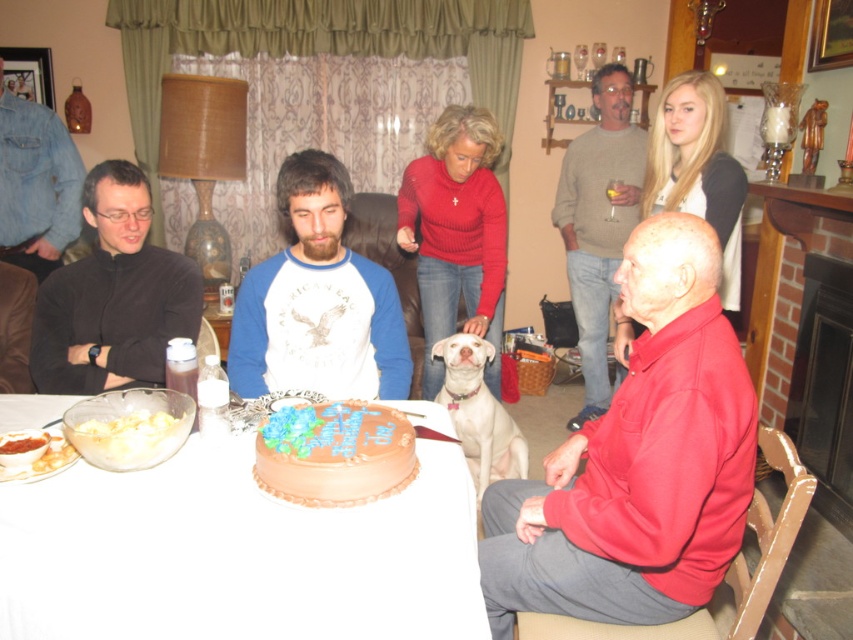
Question: Which object is farther from the camera taking this photo?

Choices:
 (A) white fur dog at center
 (B) blue cotton shirt at center
 (C) chocolate glaze cake at center

Answer: (A)

Question: Is smooth white table at center to the right of smooth white bowl at lower left from the viewer's perspective?

Choices:
 (A) no
 (B) yes

Answer: (B)

Question: Is smooth white table at center below denim jacket at left?

Choices:
 (A) yes
 (B) no

Answer: (A)

Question: Among these objects, which one is farthest from the camera?

Choices:
 (A) smooth white bowl at lower left
 (B) black matte shirt at left
 (C) red cotton shirt at lower right
 (D) denim jacket at left

Answer: (D)

Question: Which point is closer to the camera taking this photo?

Choices:
 (A) tap(55, 173)
 (B) tap(412, 576)
 (C) tap(361, 406)
 (D) tap(292, 380)

Answer: (B)

Question: Can you confirm if white fur dog at center is bigger than smooth white bowl at lower left?

Choices:
 (A) yes
 (B) no

Answer: (A)